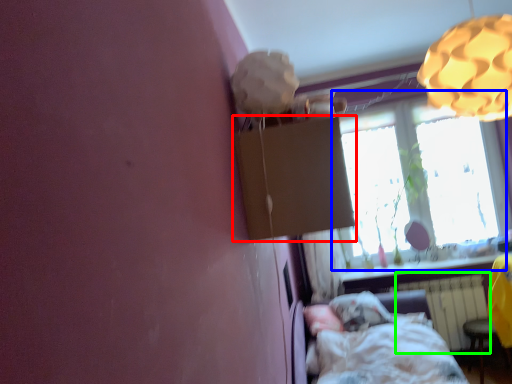
Question: Which object is positioned closest to cardboard box (highlighted by a red box)? Select from window (highlighted by a blue box) and radiator (highlighted by a green box).

Choices:
 (A) window
 (B) radiator

Answer: (B)